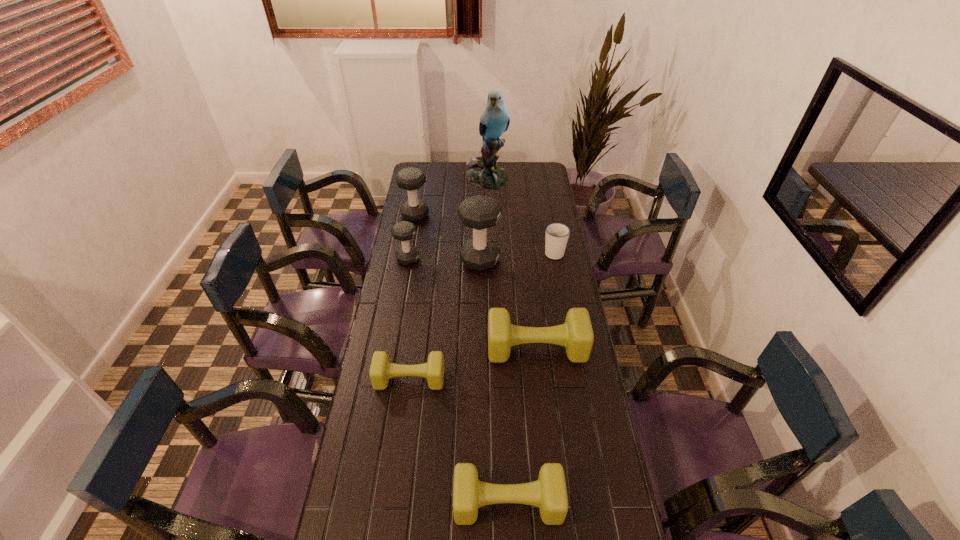
Identify the location of the second smallest olive dumbbell. tap(549, 493).

Where is `the fifth tallest dumbbell`? the fifth tallest dumbbell is located at coordinates (549, 493).

Where is `the fifth farthest dumbbell`? The image size is (960, 540). the fifth farthest dumbbell is located at coordinates (381, 370).

Where is `the second nearest olive dumbbell`? the second nearest olive dumbbell is located at coordinates (381, 370).

Identify the location of vacant point located 0.400m on the face of the parakeet. This screenshot has width=960, height=540. (489, 239).

At what (x,y) coordinates should I click in order to perform the action: click on free space located on the right of the biggest gray dumbbell. Please return your answer as a coordinate pair (x, y). Looking at the image, I should click on (538, 260).

You are a GUI agent. You are given a task and a screenshot of the screen. Output one action in this format:
    pyautogui.click(x=<x>, y=<y>)
    Task: Click on the free space located on the front of the farthest dumbbell
    
    Given the screenshot: What is the action you would take?
    pyautogui.click(x=405, y=269)

In order to click on free location located 0.400m on the back of the smallest gray dumbbell in this screenshot , I will do `click(418, 201)`.

This screenshot has height=540, width=960. What are the coordinates of `free space located 0.310m on the left of the third nearest object` in the screenshot? It's located at (404, 348).

Where is `vacant space situated 0.300m with a handle on the side of the white cup`? This screenshot has width=960, height=540. vacant space situated 0.300m with a handle on the side of the white cup is located at coordinates (545, 207).